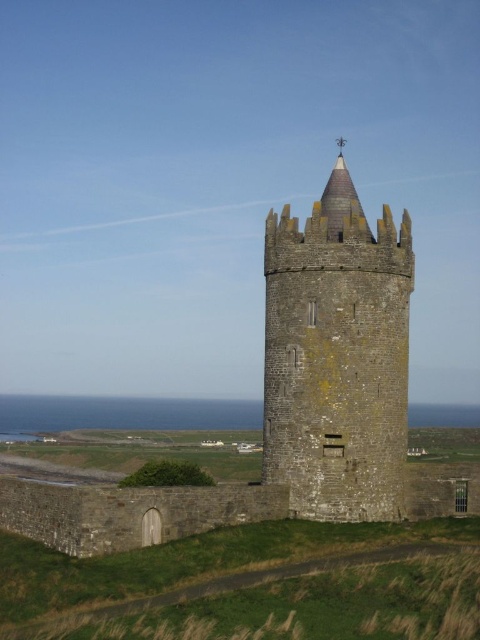
Question: Does stone tower at center have a smaller size compared to dark brown stone tower at center?

Choices:
 (A) yes
 (B) no

Answer: (B)

Question: Which of the following is the closest to the observer?

Choices:
 (A) (279, 316)
 (B) (372, 298)

Answer: (B)

Question: Is stone tower at center wider than dark brown stone tower at center?

Choices:
 (A) no
 (B) yes

Answer: (B)

Question: Does stone tower at center come in front of dark brown stone tower at center?

Choices:
 (A) no
 (B) yes

Answer: (B)